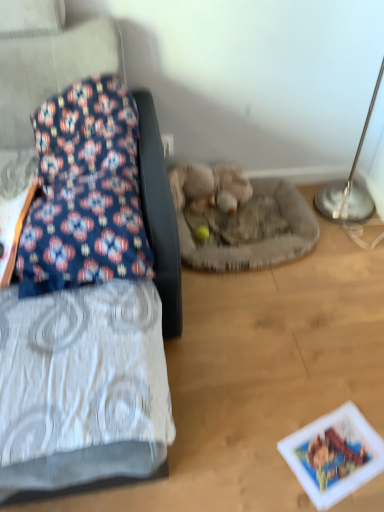
Question: From a real-world perspective, is silver metallic table lamp at upper right on fuzzy beige stuffed animal at center?

Choices:
 (A) yes
 (B) no

Answer: (A)

Question: Is silver metallic table lamp at upper right positioned beyond the bounds of fuzzy beige stuffed animal at center?

Choices:
 (A) yes
 (B) no

Answer: (A)

Question: From the image's perspective, is silver metallic table lamp at upper right on top of fuzzy beige stuffed animal at center?

Choices:
 (A) yes
 (B) no

Answer: (A)

Question: Is silver metallic table lamp at upper right positioned before fuzzy beige stuffed animal at center?

Choices:
 (A) no
 (B) yes

Answer: (B)

Question: Does silver metallic table lamp at upper right appear on the left side of fuzzy beige stuffed animal at center?

Choices:
 (A) yes
 (B) no

Answer: (B)

Question: Would you say fuzzy beige stuffed animal at center is part of silver metallic table lamp at upper right's contents?

Choices:
 (A) yes
 (B) no

Answer: (B)

Question: Can you confirm if floral fabric cushion at left is smaller than printed paper postcard at lower right?

Choices:
 (A) no
 (B) yes

Answer: (A)

Question: From a real-world perspective, is floral fabric cushion at left on printed paper postcard at lower right?

Choices:
 (A) no
 (B) yes

Answer: (B)

Question: Is floral fabric cushion at left to the left of printed paper postcard at lower right from the viewer's perspective?

Choices:
 (A) no
 (B) yes

Answer: (B)

Question: From the image's perspective, would you say floral fabric cushion at left is positioned over printed paper postcard at lower right?

Choices:
 (A) no
 (B) yes

Answer: (B)

Question: Is floral fabric cushion at left further to camera compared to printed paper postcard at lower right?

Choices:
 (A) no
 (B) yes

Answer: (A)

Question: Can you confirm if floral fabric cushion at left is taller than printed paper postcard at lower right?

Choices:
 (A) yes
 (B) no

Answer: (A)

Question: Can you confirm if floral fabric cushion at left is taller than silver metallic table lamp at upper right?

Choices:
 (A) yes
 (B) no

Answer: (A)